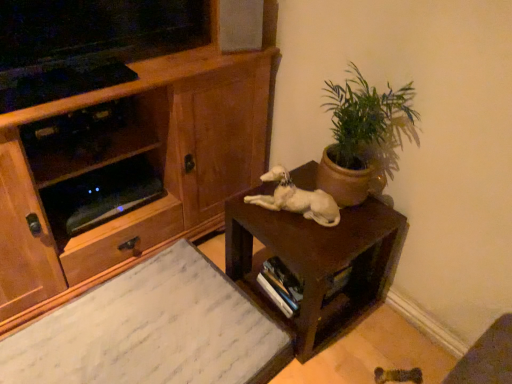
Question: From a real-world perspective, is wooden cabinet at left above or below white glossy dog at center?

Choices:
 (A) above
 (B) below

Answer: (B)

Question: Is wooden cabinet at left spatially inside white glossy dog at center, or outside of it?

Choices:
 (A) inside
 (B) outside

Answer: (B)

Question: Considering the real-world distances, which object is farthest from the wooden cabinet at left?

Choices:
 (A) brown matte table at center
 (B) white glossy dog at center
 (C) white marble desk at lower left
 (D) green matte plant at upper right

Answer: (D)

Question: Which object is positioned closest to the brown matte table at center?

Choices:
 (A) wooden cabinet at left
 (B) white marble desk at lower left
 (C) green matte plant at upper right
 (D) white glossy dog at center

Answer: (D)